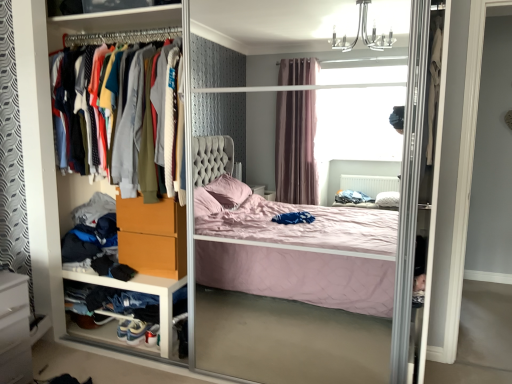
Find the location of `vacant space that is to the left of white suede sneaker at lower left, placed as the 1th shoe when sorted from left to right`. vacant space that is to the left of white suede sneaker at lower left, placed as the 1th shoe when sorted from left to right is located at coordinates (95, 340).